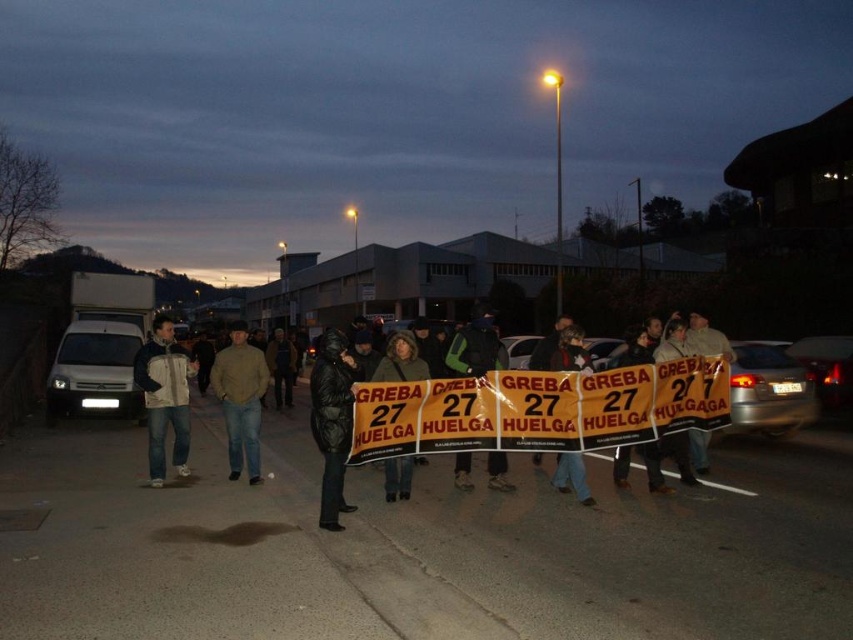
Is black matte jacket at center positioned in front of dark green jacket at center?

No.

Which is above, black matte jacket at center or dark green jacket at center?

Positioned higher is black matte jacket at center.

Does point (461, 474) come closer to viewer compared to point (409, 474)?

No, it is behind (409, 474).

Find the location of a particular element. Image resolution: width=853 pixels, height=640 pixels. black matte jacket at center is located at coordinates (474, 348).

Can you confirm if black jacket at center is bigger than black puffy coat at center?

Incorrect, black jacket at center is not larger than black puffy coat at center.

Is black jacket at center closer to camera compared to black puffy coat at center?

Yes, black jacket at center is in front of black puffy coat at center.

Is point (418, 420) positioned behind point (332, 445)?

Yes, it is behind point (332, 445).

Locate an element on the screen. black jacket at center is located at coordinates (498, 412).

Is light brown sweater at center to the right of black matte jacket at center from the viewer's perspective?

In fact, light brown sweater at center is to the left of black matte jacket at center.

Which of these two, light brown sweater at center or black matte jacket at center, stands taller?

light brown sweater at center

Does point (257, 387) lie in front of point (506, 468)?

No.

You are a GUI agent. You are given a task and a screenshot of the screen. Output one action in this format:
    pyautogui.click(x=<x>, y=<y>)
    Task: Click on the light brown sweater at center
    
    Given the screenshot: What is the action you would take?
    pyautogui.click(x=241, y=400)